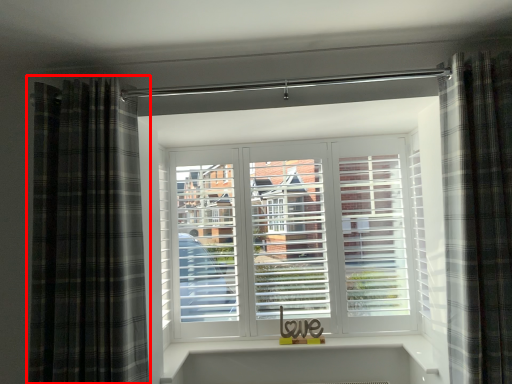
Question: From the image's perspective, where is curtain (annotated by the red box) located relative to curtain?

Choices:
 (A) below
 (B) above

Answer: (A)